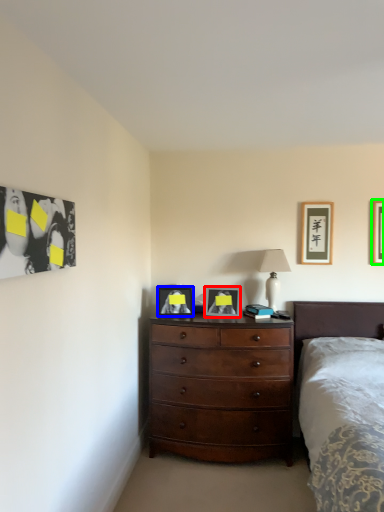
Question: Which object is the closest to the picture frame (highlighted by a red box)? Choose among these: picture frame (highlighted by a blue box) or picture frame (highlighted by a green box).

Choices:
 (A) picture frame
 (B) picture frame

Answer: (A)